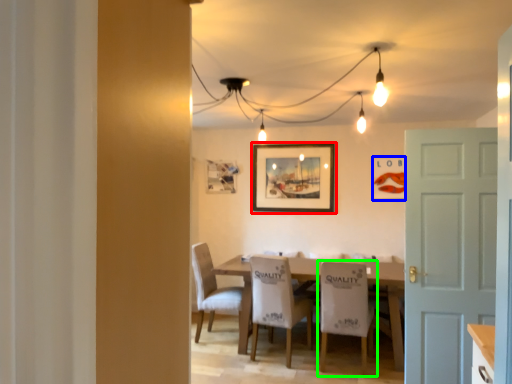
Question: Considering the real-world distances, which object is farthest from picture frame (highlighted by a red box)? picture frame (highlighted by a blue box) or chair (highlighted by a green box)?

Choices:
 (A) picture frame
 (B) chair

Answer: (B)